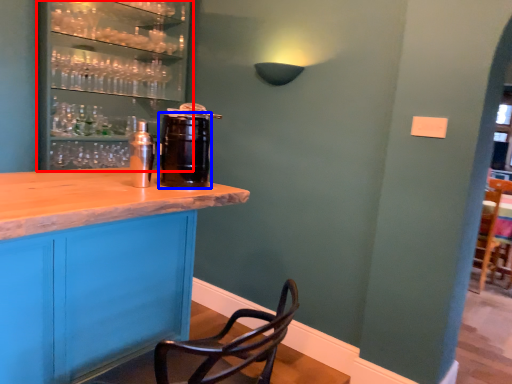
Question: Which object is further to the camera taking this photo, shelf (highlighted by a red box) or beverage (highlighted by a blue box)?

Choices:
 (A) shelf
 (B) beverage

Answer: (A)